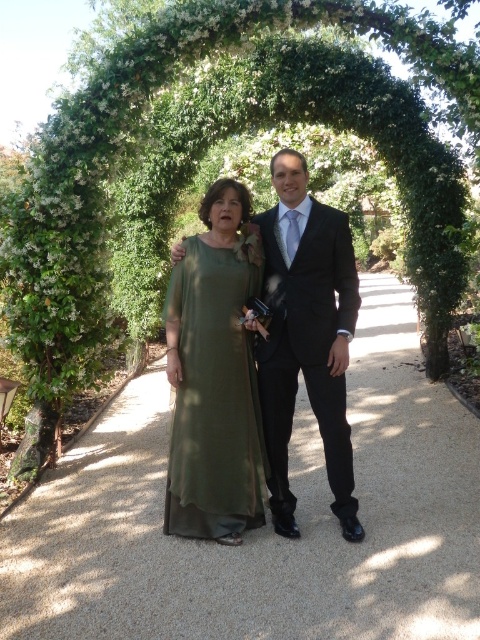
Which is more to the left, olive green satin dress at center or black satin suit at center?

From the viewer's perspective, olive green satin dress at center appears more on the left side.

Does olive green satin dress at center appear on the left side of black satin suit at center?

Yes, olive green satin dress at center is to the left of black satin suit at center.

This screenshot has height=640, width=480. Describe the element at coordinates (215, 394) in the screenshot. I see `olive green satin dress at center` at that location.

This screenshot has width=480, height=640. In order to click on olive green satin dress at center in this screenshot , I will do `click(215, 394)`.

Can you confirm if gravel pathway at center is positioned to the right of olive green satin dress at center?

Correct, you'll find gravel pathway at center to the right of olive green satin dress at center.

Can you confirm if gravel pathway at center is positioned above olive green satin dress at center?

Actually, gravel pathway at center is below olive green satin dress at center.

Where is `gravel pathway at center`? The width and height of the screenshot is (480, 640). gravel pathway at center is located at coordinates (267, 520).

The width and height of the screenshot is (480, 640). Identify the location of gravel pathway at center. (267, 520).

Does matte green dress at center have a smaller size compared to olive green satin dress at center?

Incorrect, matte green dress at center is not smaller in size than olive green satin dress at center.

Between matte green dress at center and olive green satin dress at center, which one has more height?

matte green dress at center

This screenshot has height=640, width=480. What are the coordinates of `matte green dress at center` in the screenshot? It's located at (307, 337).